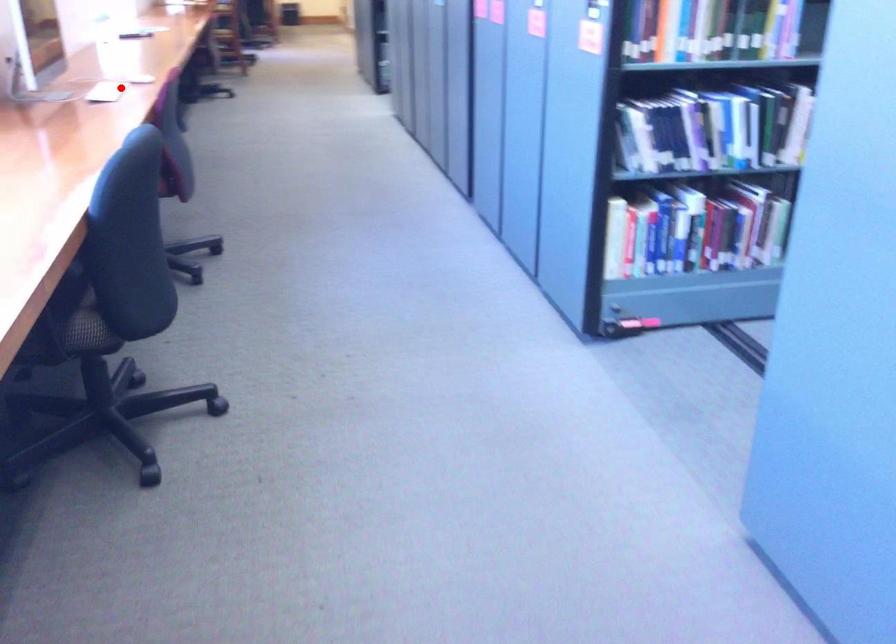
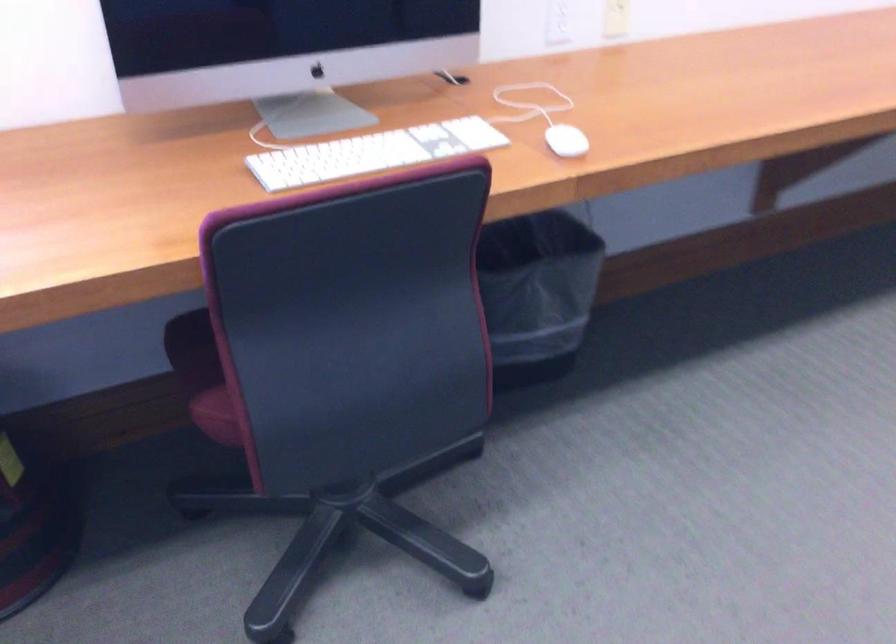
Find the pixel in the second image that matches the highlighted location in the first image.

(372, 153)